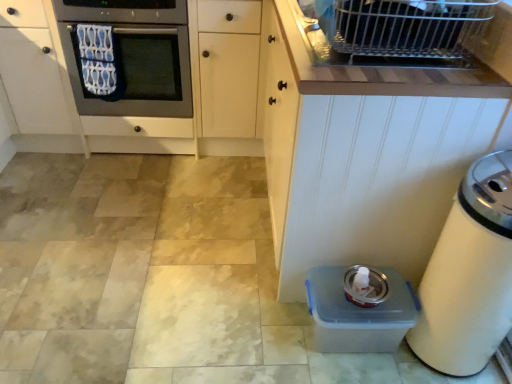
Question: Is white wood cabinet at lower right located within clear plastic container at lower right?

Choices:
 (A) no
 (B) yes

Answer: (A)

Question: Is clear plastic container at lower right next to white wood cabinet at lower right?

Choices:
 (A) yes
 (B) no

Answer: (B)

Question: Could you tell me if clear plastic container at lower right is facing white wood cabinet at lower right?

Choices:
 (A) yes
 (B) no

Answer: (B)

Question: Is clear plastic container at lower right not near white wood cabinet at lower right?

Choices:
 (A) yes
 (B) no

Answer: (B)

Question: From the image's perspective, does clear plastic container at lower right appear lower than white wood cabinet at lower right?

Choices:
 (A) no
 (B) yes

Answer: (B)

Question: From the image's perspective, relative to metallic gray oven at left, is white plastic trash can at lower right above or below?

Choices:
 (A) below
 (B) above

Answer: (A)

Question: From their relative heights in the image, would you say white plastic trash can at lower right is taller or shorter than metallic gray oven at left?

Choices:
 (A) tall
 (B) short

Answer: (A)

Question: Is point (493, 178) positioned closer to the camera than point (80, 41)?

Choices:
 (A) closer
 (B) farther

Answer: (A)

Question: Looking at their shapes, would you say white plastic trash can at lower right is wider or thinner than metallic gray oven at left?

Choices:
 (A) wide
 (B) thin

Answer: (B)

Question: Is point (369, 289) positioned closer to the camera than point (133, 91)?

Choices:
 (A) farther
 (B) closer

Answer: (B)

Question: From the image's perspective, is clear plastic container at lower right positioned above or below metallic gray oven at left?

Choices:
 (A) above
 (B) below

Answer: (B)

Question: Is clear plastic container at lower right in front of or behind metallic gray oven at left in the image?

Choices:
 (A) behind
 (B) front

Answer: (B)

Question: Considering the relative positions of clear plastic container at lower right and metallic gray oven at left in the image provided, is clear plastic container at lower right to the left or to the right of metallic gray oven at left?

Choices:
 (A) left
 (B) right

Answer: (B)

Question: Is point (445, 74) closer or farther from the camera than point (394, 309)?

Choices:
 (A) farther
 (B) closer

Answer: (B)

Question: Considering the relative positions of white wood cabinet at lower right and clear plastic container at lower right in the image provided, is white wood cabinet at lower right to the left or to the right of clear plastic container at lower right?

Choices:
 (A) right
 (B) left

Answer: (B)